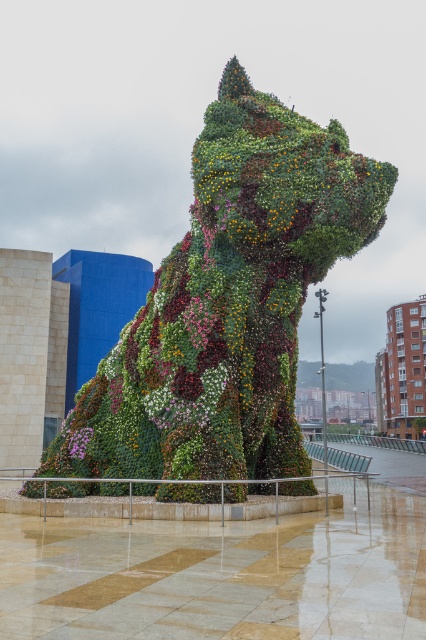
You are standing at the center of the walkway in front of the floral greenery dog at center. If you walk straight ahead, will you collide with the sculpture?

The floral greenery dog at center is positioned at point (230, 301), which is slightly to the right and forward from the center. Walking straight ahead might lead you to miss the sculpture slightly to the right, so you might not collide. However, the exact path depends on the walkway layout not specified here.

Looking at this image, you are standing in front of the sculpture and want to take a photo of both the floral greenery dog at center and the pink matte flower at center. Which object should you focus on first to ensure both are in clear view?

You should focus on the floral greenery dog at center first because it is closer to you than the pink matte flower at center, ensuring both will be in clear view when focused on the closer object.

You are a gardener tasked with watering the floral greenery dog at center and the pink matte flower at center. You have a watering can with a 1 meter reach. If you are standing at the base of the sculpture, can you water both objects without moving your position?

The floral greenery dog at center might be wider than pink matte flower at center, but since both are at the center, the watering can with a 1 meter reach should be sufficient to water both without moving.